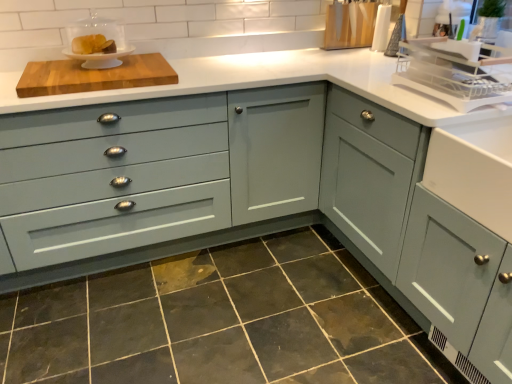
Question: From a real-world perspective, is matte gray cabinet at right, which is the 2th cabinetry in left-to-right order, on top of matte gray cabinet at center, which is the second cabinetry from right to left?

Choices:
 (A) no
 (B) yes

Answer: (A)

Question: Can you confirm if matte gray cabinet at right, which is the 2th cabinetry in left-to-right order, is thinner than matte gray cabinet at center, which is the 1th cabinetry from left to right?

Choices:
 (A) no
 (B) yes

Answer: (A)

Question: Is the depth of matte gray cabinet at right, which is the 2th cabinetry in left-to-right order, less than that of matte gray cabinet at center, which is the second cabinetry from right to left?

Choices:
 (A) yes
 (B) no

Answer: (A)

Question: Is matte gray cabinet at right, which is the 2th cabinetry in left-to-right order, far from matte gray cabinet at center, which is the second cabinetry from right to left?

Choices:
 (A) yes
 (B) no

Answer: (B)

Question: Is matte gray cabinet at right, the first cabinetry when ordered from right to left, facing towards matte gray cabinet at center, which is the 1th cabinetry from left to right?

Choices:
 (A) no
 (B) yes

Answer: (B)

Question: From their relative heights in the image, would you say matte gray cabinet at center, which is the 1th cabinetry from left to right, is taller or shorter than white glossy cake stand at upper left, which appears as the 1th appliance when viewed from the left?

Choices:
 (A) tall
 (B) short

Answer: (A)

Question: Choose the correct answer: Is matte gray cabinet at center, which is the 1th cabinetry from left to right, inside white glossy cake stand at upper left, the 2th appliance when ordered from back to front, or outside it?

Choices:
 (A) inside
 (B) outside

Answer: (B)

Question: Considering the positions of matte gray cabinet at center, which is the second cabinetry from right to left, and white glossy cake stand at upper left, positioned as the third appliance in right-to-left order, in the image, is matte gray cabinet at center, which is the second cabinetry from right to left, bigger or smaller than white glossy cake stand at upper left, positioned as the third appliance in right-to-left order,?

Choices:
 (A) small
 (B) big

Answer: (B)

Question: Considering their positions, is matte gray cabinet at center, which is the 1th cabinetry from left to right, located in front of or behind white glossy cake stand at upper left, which appears as the 1th appliance when viewed from the left?

Choices:
 (A) front
 (B) behind

Answer: (A)

Question: Is dark gray granite at lower center situated inside white glossy cake stand at upper left, which appears as the 1th appliance when viewed from the left, or outside?

Choices:
 (A) inside
 (B) outside

Answer: (B)

Question: In terms of size, does dark gray granite at lower center appear bigger or smaller than white glossy cake stand at upper left, the 2th appliance when ordered from back to front?

Choices:
 (A) small
 (B) big

Answer: (B)

Question: Looking at their shapes, would you say dark gray granite at lower center is wider or thinner than white glossy cake stand at upper left, which appears as the 1th appliance when viewed from the left?

Choices:
 (A) wide
 (B) thin

Answer: (A)

Question: From the image's perspective, is dark gray granite at lower center positioned above or below white glossy cake stand at upper left, arranged as the second appliance when viewed from the front?

Choices:
 (A) below
 (B) above

Answer: (A)

Question: From the image's perspective, is matte gray cabinet at right, the first cabinetry when ordered from right to left, positioned above or below wooden cutting board at upper left?

Choices:
 (A) above
 (B) below

Answer: (B)

Question: In terms of width, does matte gray cabinet at right, the first cabinetry when ordered from right to left, look wider or thinner when compared to wooden cutting board at upper left?

Choices:
 (A) wide
 (B) thin

Answer: (A)